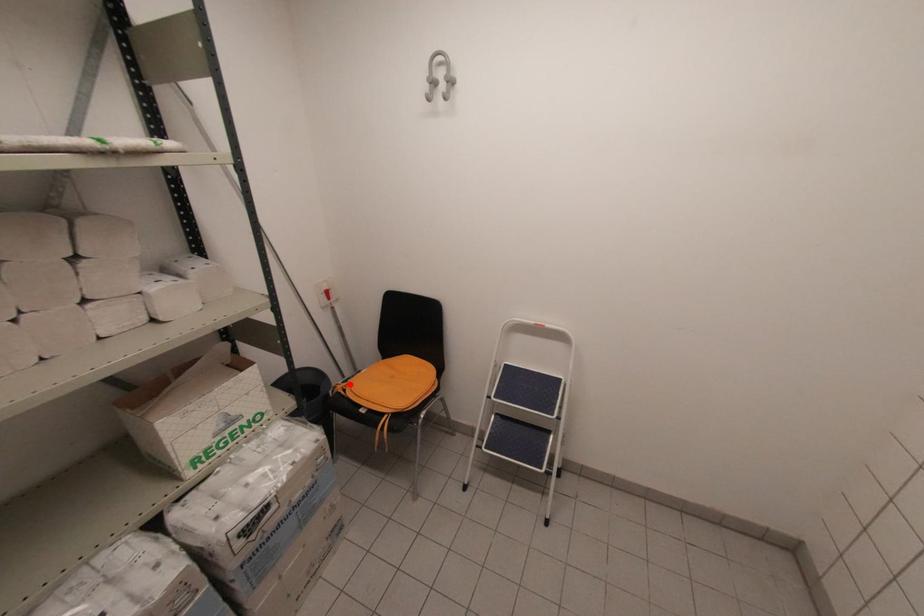
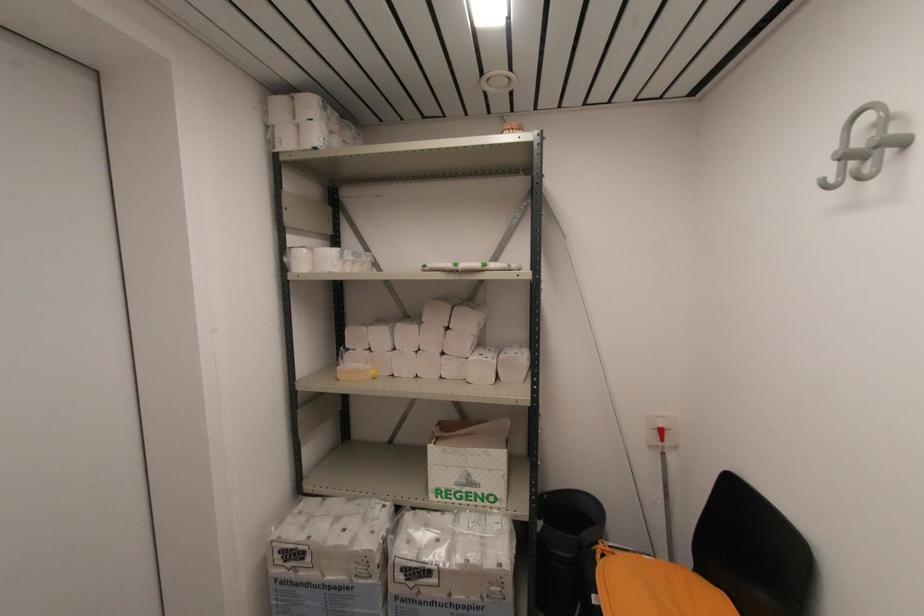
The point at the highlighted location is marked in the first image. Where is the corresponding point in the second image?

(614, 554)